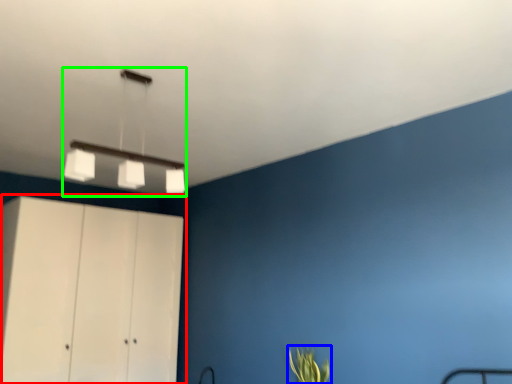
Question: Which is nearer to the cupboard (highlighted by a red box)? plant (highlighted by a blue box) or lamp (highlighted by a green box).

Choices:
 (A) plant
 (B) lamp

Answer: (B)